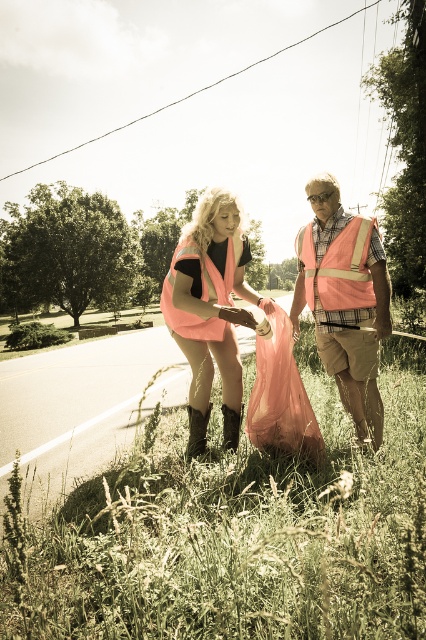
Question: Which point is farther from the camera taking this photo?

Choices:
 (A) (241, 310)
 (B) (370, 348)

Answer: (B)

Question: Considering the relative positions of green grass at lower center and orange reflective safety vest at right in the image provided, where is green grass at lower center located with respect to orange reflective safety vest at right?

Choices:
 (A) right
 (B) left

Answer: (B)

Question: Is green grass at lower center thinner than orange reflective safety vest at right?

Choices:
 (A) yes
 (B) no

Answer: (B)

Question: Is pink fabric vest at center wider than pink fabric safety vest at center?

Choices:
 (A) no
 (B) yes

Answer: (A)

Question: Estimate the real-world distances between objects in this image. Which object is closer to the green grass at lower center?

Choices:
 (A) orange reflective safety vest at right
 (B) pink fabric safety vest at center
 (C) neon orange vest at center
 (D) pink fabric vest at center

Answer: (C)

Question: Considering the real-world distances, which object is farthest from the reflective orange vest at center?

Choices:
 (A) orange reflective safety vest at right
 (B) pink fabric vest at center
 (C) neon orange vest at center

Answer: (B)